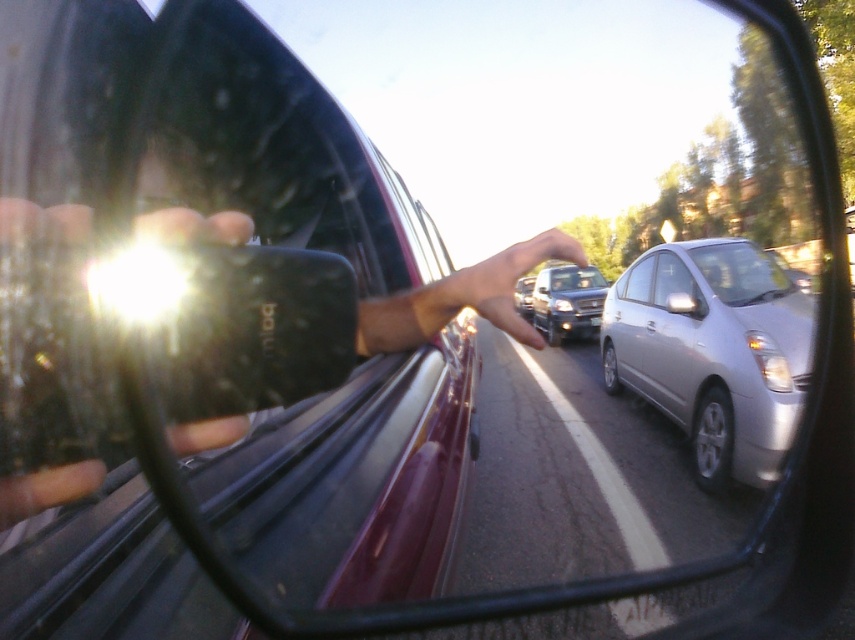
Between silver metallic car at center and silver metallic sedan at center, which one has less height?

With less height is silver metallic sedan at center.

Can you confirm if silver metallic car at center is positioned above silver metallic sedan at center?

No.

You are a GUI agent. You are given a task and a screenshot of the screen. Output one action in this format:
    pyautogui.click(x=<x>, y=<y>)
    Task: Click on the silver metallic car at center
    This screenshot has width=855, height=640.
    Given the screenshot: What is the action you would take?
    pyautogui.click(x=712, y=352)

Where is `silver metallic car at center`? The width and height of the screenshot is (855, 640). silver metallic car at center is located at coordinates (712, 352).

Is matte black hand at center to the left of satin silver car window at center from the viewer's perspective?

Correct, you'll find matte black hand at center to the left of satin silver car window at center.

Between point (84, 472) and point (693, 289), which one is positioned in front?

Point (84, 472)

The height and width of the screenshot is (640, 855). I want to click on matte black hand at center, so click(x=46, y=490).

Does metallic silver sedan at center appear over silver metallic sedan at center?

Yes, metallic silver sedan at center is above silver metallic sedan at center.

Between point (535, 323) and point (531, 298), which one is positioned in front?

Positioned in front is point (535, 323).

Is point (605, 292) farther from viewer compared to point (517, 291)?

No, (605, 292) is closer to viewer.

Where is `metallic silver sedan at center`? The height and width of the screenshot is (640, 855). metallic silver sedan at center is located at coordinates (568, 301).